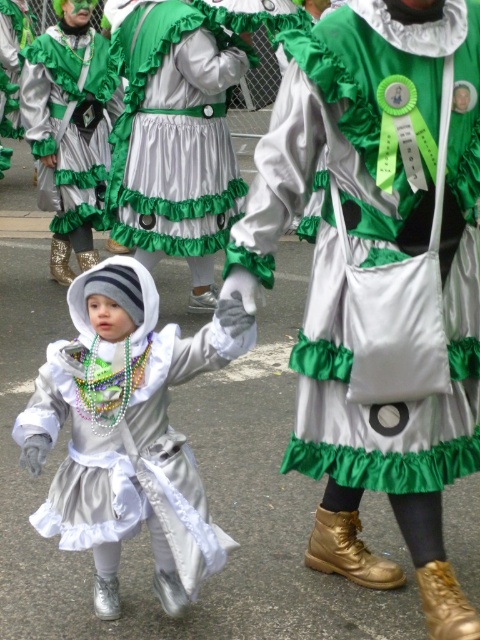
Is satin silver dress at center below satin/green apron at center?

Yes.

Can you confirm if satin silver dress at center is taller than satin/green apron at center?

In fact, satin silver dress at center may be shorter than satin/green apron at center.

Identify the location of satin silver dress at center. The width and height of the screenshot is (480, 640). (128, 433).

Where is `satin silver dress at center`? The image size is (480, 640). satin silver dress at center is located at coordinates (128, 433).

Measure the distance between satin/green apron at center and green satin dress at center.

satin/green apron at center and green satin dress at center are 67.16 centimeters apart from each other.

Which is in front, point (188, 28) or point (59, 100)?

Point (188, 28) is in front.

You are a GUI agent. You are given a task and a screenshot of the screen. Output one action in this format:
    pyautogui.click(x=<x>, y=<y>)
    Task: Click on the satin/green apron at center
    Image resolution: width=480 pixels, height=640 pixels.
    Given the screenshot: What is the action you would take?
    pyautogui.click(x=173, y=131)

Can you confirm if satin green purse at center is smaller than satin/green apron at center?

Yes, satin green purse at center is smaller than satin/green apron at center.

Is satin green purse at center taller than satin/green apron at center?

Incorrect, satin green purse at center's height is not larger of satin/green apron at center's.

Does point (469, 80) come closer to viewer compared to point (151, 180)?

That is True.

Locate an element on the screen. The image size is (480, 640). satin green purse at center is located at coordinates (377, 243).